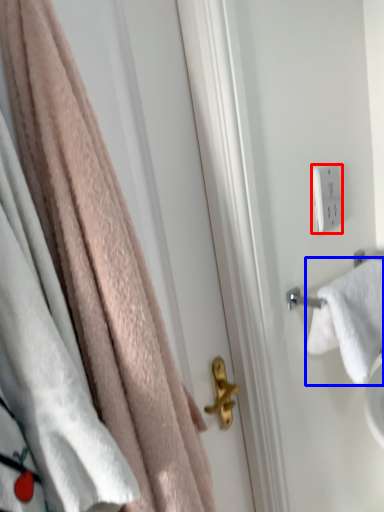
Question: Which object is closer to the camera taking this photo, light switch (highlighted by a red box) or towel (highlighted by a blue box)?

Choices:
 (A) light switch
 (B) towel

Answer: (B)